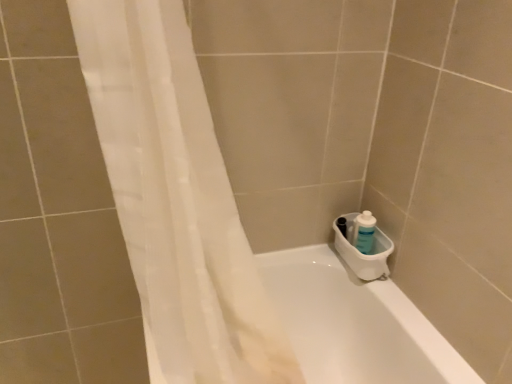
Question: Can you confirm if white sheer curtain at left is positioned to the left of white plastic sink at lower right?

Choices:
 (A) yes
 (B) no

Answer: (A)

Question: Is white sheer curtain at left bigger than white plastic sink at lower right?

Choices:
 (A) yes
 (B) no

Answer: (A)

Question: From the image's perspective, does white sheer curtain at left appear lower than white plastic sink at lower right?

Choices:
 (A) yes
 (B) no

Answer: (B)

Question: Is white sheer curtain at left located outside white plastic sink at lower right?

Choices:
 (A) yes
 (B) no

Answer: (A)

Question: From the image's perspective, is white sheer curtain at left over white plastic sink at lower right?

Choices:
 (A) yes
 (B) no

Answer: (A)

Question: Looking at the image, does white sheer curtain at left seem bigger or smaller compared to blue plastic bottle at right?

Choices:
 (A) big
 (B) small

Answer: (A)

Question: Considering the positions of white sheer curtain at left and blue plastic bottle at right in the image, is white sheer curtain at left wider or thinner than blue plastic bottle at right?

Choices:
 (A) thin
 (B) wide

Answer: (B)

Question: Is point (228, 251) closer or farther from the camera than point (361, 251)?

Choices:
 (A) closer
 (B) farther

Answer: (A)

Question: Is white sheer curtain at left in front of or behind blue plastic bottle at right in the image?

Choices:
 (A) front
 (B) behind

Answer: (A)

Question: From a real-world perspective, is white glossy bathtub at lower right physically located above or below blue plastic bottle at right?

Choices:
 (A) below
 (B) above

Answer: (A)

Question: Considering the positions of white glossy bathtub at lower right and blue plastic bottle at right in the image, is white glossy bathtub at lower right wider or thinner than blue plastic bottle at right?

Choices:
 (A) thin
 (B) wide

Answer: (B)

Question: In terms of height, does white glossy bathtub at lower right look taller or shorter compared to blue plastic bottle at right?

Choices:
 (A) short
 (B) tall

Answer: (B)

Question: From the image's perspective, is white glossy bathtub at lower right above or below blue plastic bottle at right?

Choices:
 (A) below
 (B) above

Answer: (A)

Question: Considering the positions of point (121, 175) and point (347, 263), is point (121, 175) closer or farther from the camera than point (347, 263)?

Choices:
 (A) closer
 (B) farther

Answer: (A)

Question: Is white sheer curtain at left inside the boundaries of white plastic sink at lower right, or outside?

Choices:
 (A) outside
 (B) inside

Answer: (A)